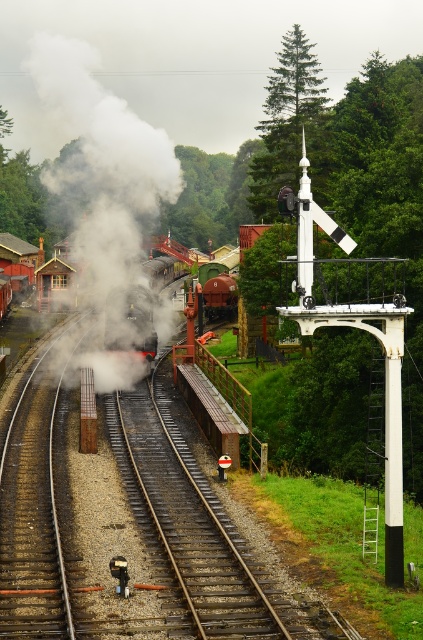
Question: Is white matte steam at center to the right of rusty metal train track at center from the viewer's perspective?

Choices:
 (A) no
 (B) yes

Answer: (A)

Question: Which point is closer to the camera?

Choices:
 (A) rusty metal train track at center
 (B) white matte steam at center

Answer: (A)

Question: Does white matte steam at center have a smaller size compared to rusty metal train track at center?

Choices:
 (A) no
 (B) yes

Answer: (A)

Question: Which of the following is the farthest from the observer?

Choices:
 (A) white matte steam at center
 (B) rusty metal train track at center

Answer: (A)

Question: Is white matte steam at center positioned at the back of rusty metal train track at center?

Choices:
 (A) no
 (B) yes

Answer: (B)

Question: Which of the following is the closest to the observer?

Choices:
 (A) rusty metal train track at center
 (B) white matte steam at center

Answer: (A)